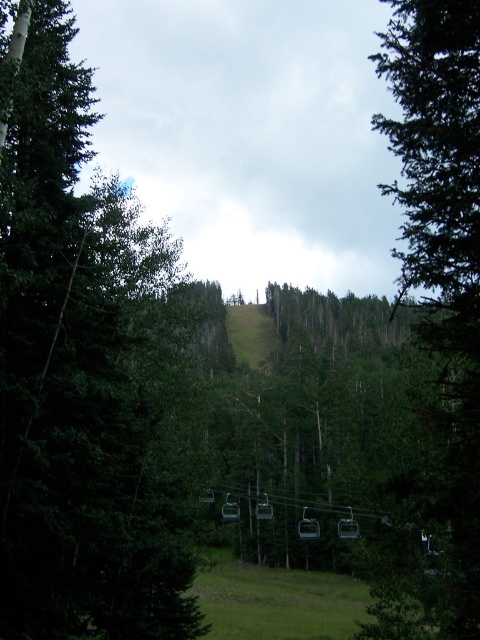
Question: Is green matte tree at left wider than green matte tree at center?

Choices:
 (A) no
 (B) yes

Answer: (A)

Question: Can you confirm if green matte tree at center is wider than green grassy ski slope at center?

Choices:
 (A) no
 (B) yes

Answer: (B)

Question: Among these points, which one is nearest to the camera?

Choices:
 (A) (448, 524)
 (B) (26, 445)

Answer: (B)

Question: Which point is closer to the camera?

Choices:
 (A) coord(410,280)
 (B) coord(260,310)
 (C) coord(90,195)

Answer: (A)

Question: Which point is farther to the camera?

Choices:
 (A) (436, 368)
 (B) (247, 339)

Answer: (B)

Question: Does green matte tree at left have a smaller size compared to green matte tree at center?

Choices:
 (A) yes
 (B) no

Answer: (A)